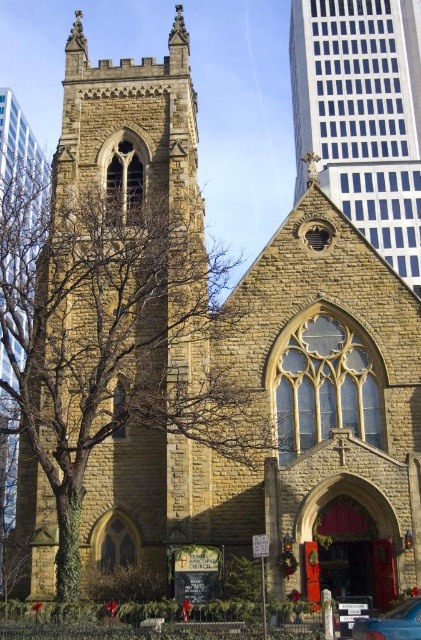
You are a pedestrian standing at the entrance of the stone church tower at center. You want to cross the street to reach a park located at the lower left. Can you see the metallic blue car at lower right from your current position?

Answer: The metallic blue car at lower right is behind the stone church tower at center, so you cannot see it from your current position at the entrance of the stone church tower at center.

You are a tourist standing in front of the historic church. You notice the brown stone tree at left and the stone church tower at center. Which object appears bigger in the image?

The brown stone tree at left appears bigger than the stone church tower at center because it has a larger size compared to the tower.

A delivery person needs to park their metallic blue car at lower right as close as possible to the brown stone tree at left without blocking the entrance. What is the minimum distance they can park the car from the tree?

The brown stone tree at left is 25.43 meters from metallic blue car at lower right. The minimum distance they can park the car from the tree is 25.43 meters.